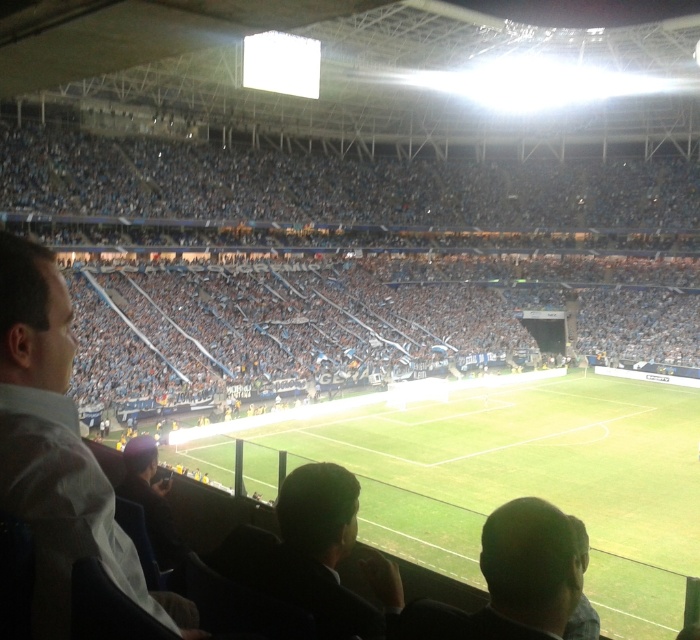
Does white shirt at left have a larger size compared to dark green fabric at lower center?

Correct, white shirt at left is larger in size than dark green fabric at lower center.

Can you confirm if white shirt at left is positioned to the right of dark green fabric at lower center?

No, white shirt at left is not to the right of dark green fabric at lower center.

Which is in front, point (48, 253) or point (336, 518)?

Positioned in front is point (48, 253).

At what (x,y) coordinates should I click in order to perform the action: click on white shirt at left. Please return your answer as a coordinate pair (x, y). This screenshot has height=640, width=700. Looking at the image, I should click on (57, 451).

Who is taller, green grass football field at center or dark green fabric at lower center?

green grass football field at center

Consider the image. Who is lower down, green grass football field at center or dark green fabric at lower center?

Positioned lower is green grass football field at center.

Between point (504, 429) and point (328, 572), which one is positioned in front?

Point (328, 572)

Find the location of a particular element. The height and width of the screenshot is (640, 700). green grass football field at center is located at coordinates (525, 481).

Does green grass football field at center have a lesser height compared to white shirt at left?

No, green grass football field at center is not shorter than white shirt at left.

Is green grass football field at center positioned at the back of white shirt at left?

Yes, it is behind white shirt at left.

Between point (420, 502) and point (41, 566), which one is positioned in front?

Point (41, 566)

I want to click on green grass football field at center, so click(525, 481).